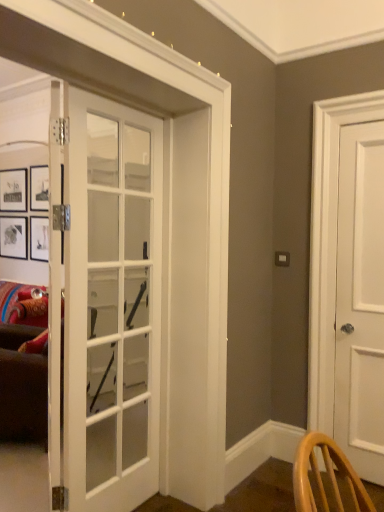
Question: Is white glass door at center, the first door viewed from the front, taller or shorter than white matte door at right, placed as the 1th door when sorted from back to front?

Choices:
 (A) short
 (B) tall

Answer: (A)

Question: Visually, is white glass door at center, the first door viewed from the front, positioned to the left or to the right of white matte door at right, which is the second door in front-to-back order?

Choices:
 (A) left
 (B) right

Answer: (A)

Question: Is white glass door at center, which is the second door from right to left, wider or thinner than white matte door at right, placed as the 1th door when sorted from back to front?

Choices:
 (A) thin
 (B) wide

Answer: (A)

Question: Is point (380, 274) positioned closer to the camera than point (72, 120)?

Choices:
 (A) closer
 (B) farther

Answer: (B)

Question: Is white matte door at right, the 2th door in the left-to-right sequence, to the left or to the right of white glass door at center, which is the 1th door from left to right, in the image?

Choices:
 (A) right
 (B) left

Answer: (A)

Question: Is white matte door at right, placed as the 1th door when sorted from back to front, wider or thinner than white glass door at center, positioned as the 2th door in back-to-front order?

Choices:
 (A) wide
 (B) thin

Answer: (A)

Question: In terms of size, does white matte door at right, which is the second door in front-to-back order, appear bigger or smaller than white glass door at center, which is the second door from right to left?

Choices:
 (A) big
 (B) small

Answer: (B)